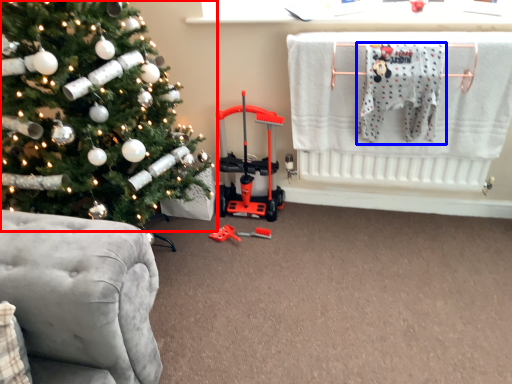
Question: Which point is further to the camera, christmas tree (highlighted by a red box) or baby clothe (highlighted by a blue box)?

Choices:
 (A) christmas tree
 (B) baby clothe

Answer: (B)